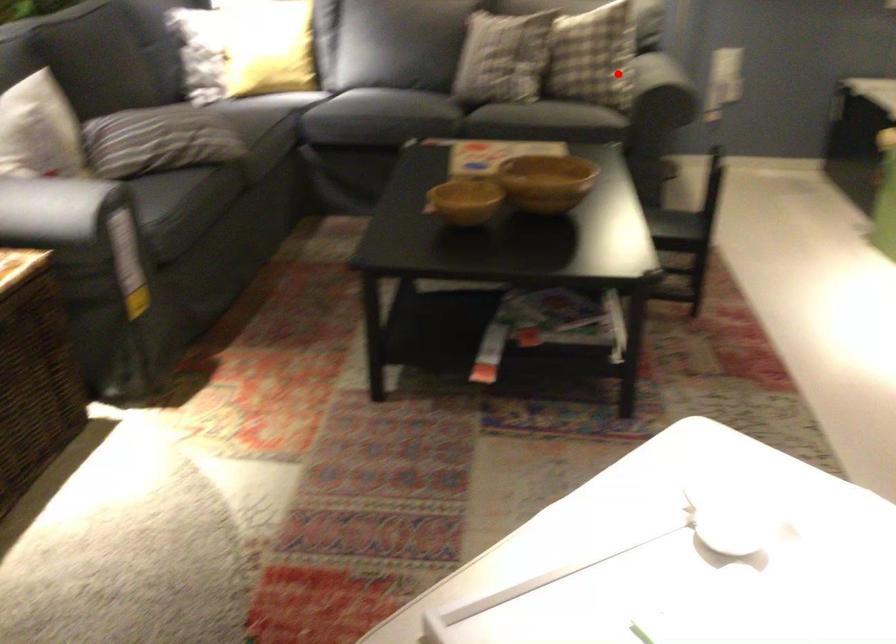
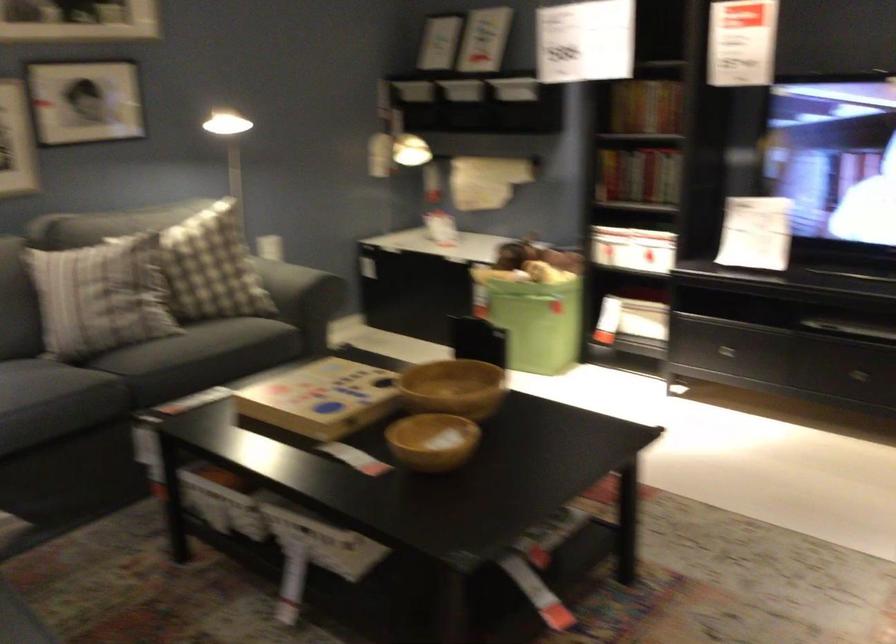
In the second image, find the point that corresponds to the highlighted location in the first image.

(286, 285)